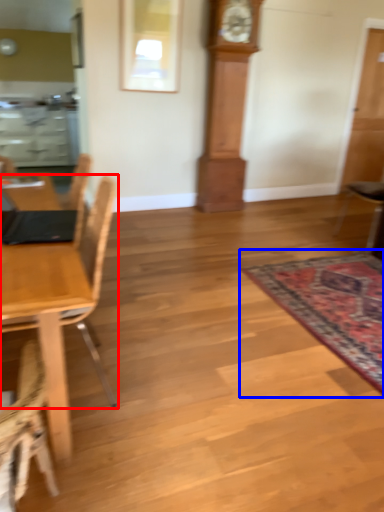
Question: Which of the following is the farthest to the observer, chair (highlighted by a red box) or mat (highlighted by a blue box)?

Choices:
 (A) chair
 (B) mat

Answer: (B)